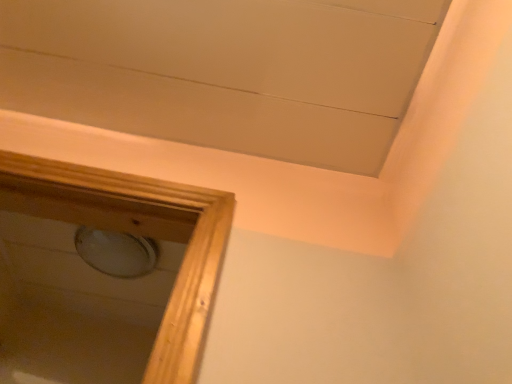
Locate an element on the screen. white glossy plate at center is located at coordinates (116, 252).

The width and height of the screenshot is (512, 384). Describe the element at coordinates (116, 252) in the screenshot. I see `white glossy plate at center` at that location.

Where is `white glossy plate at center`? white glossy plate at center is located at coordinates (116, 252).